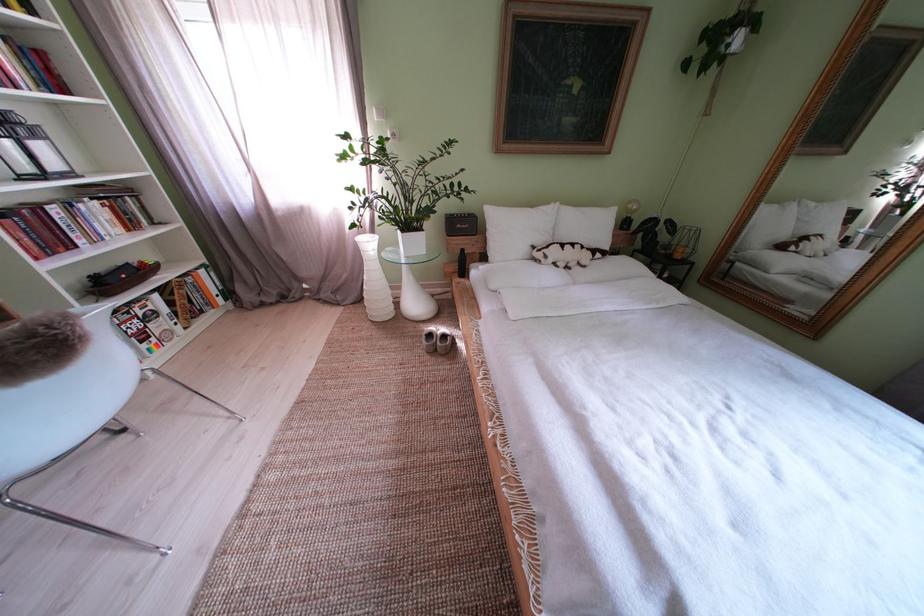
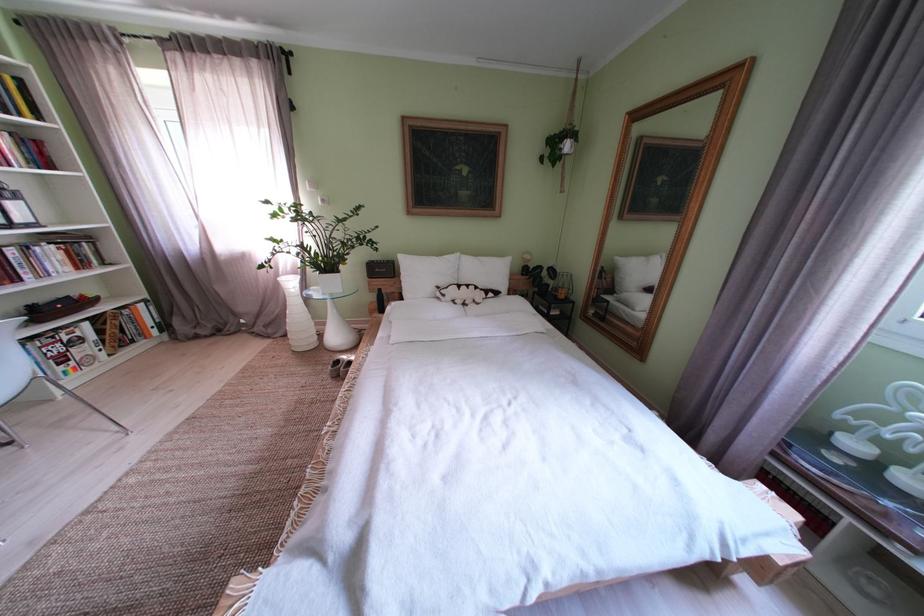
In the second image, find the point that corresponds to point 556,262 in the first image.

(455, 301)